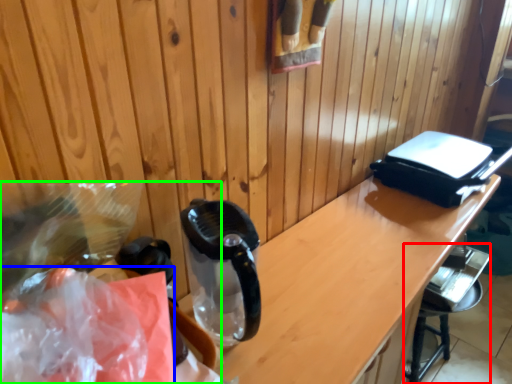
Question: Based on their relative distances, which object is farther from bar stool (highlighted by a red box)? Choose from plastic bag (highlighted by a blue box) and waste (highlighted by a green box).

Choices:
 (A) plastic bag
 (B) waste

Answer: (A)